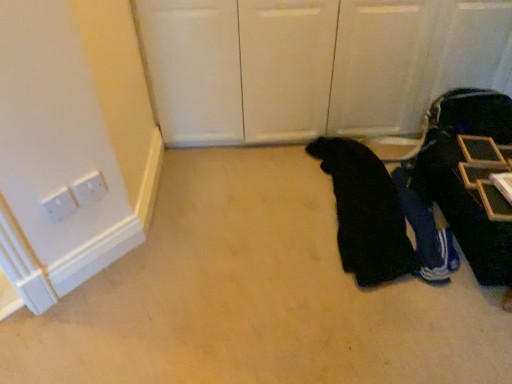
The height and width of the screenshot is (384, 512). I want to click on dark blue fabric suitcase at right, so click(x=462, y=177).

This screenshot has height=384, width=512. Describe the element at coordinates (462, 177) in the screenshot. I see `dark blue fabric suitcase at right` at that location.

The image size is (512, 384). Identify the location of blue fabric pants at lower right, acting as the first person starting from the right. (426, 233).

Is dark blue fabric suitcase at right at the back of black fabric at lower right, acting as the first person starting from the left?

No, black fabric at lower right, acting as the first person starting from the left,'s orientation is not away from dark blue fabric suitcase at right.

Is black fabric at lower right, acting as the first person starting from the left, bigger than dark blue fabric suitcase at right?

Incorrect, black fabric at lower right, acting as the first person starting from the left, is not larger than dark blue fabric suitcase at right.

From a real-world perspective, does black fabric at lower right, acting as the first person starting from the left, stand above dark blue fabric suitcase at right?

Answer: No, from a real-world perspective, black fabric at lower right, acting as the first person starting from the left, is not on top of dark blue fabric suitcase at right.

Is blue fabric pants at lower right, marked as the 2th person in a left-to-right arrangement, further to camera compared to dark blue fabric suitcase at right?

That is True.

Is blue fabric pants at lower right, marked as the 2th person in a left-to-right arrangement, facing away from dark blue fabric suitcase at right?

blue fabric pants at lower right, marked as the 2th person in a left-to-right arrangement, is not turned away from dark blue fabric suitcase at right.

Looking at this image, could blue fabric pants at lower right, acting as the first person starting from the right, be considered to be inside black fabric at lower right, positioned as the second person in right-to-left order?

No, blue fabric pants at lower right, acting as the first person starting from the right, is not surrounded by black fabric at lower right, positioned as the second person in right-to-left order.

Is black fabric at lower right, acting as the first person starting from the left, positioned with its back to blue fabric pants at lower right, acting as the first person starting from the right?

black fabric at lower right, acting as the first person starting from the left, is not turned away from blue fabric pants at lower right, acting as the first person starting from the right.

Considering the positions of points (377, 184) and (445, 271), is point (377, 184) closer to camera compared to point (445, 271)?

That is False.

The height and width of the screenshot is (384, 512). Identify the location of person below the black fabric at lower right, positioned as the second person in right-to-left order (from the image's perspective). (426, 233).

Who is shorter, dark blue fabric suitcase at right or blue fabric pants at lower right, acting as the first person starting from the right?

With less height is blue fabric pants at lower right, acting as the first person starting from the right.

Which object is closer to the camera, dark blue fabric suitcase at right or blue fabric pants at lower right, acting as the first person starting from the right?

dark blue fabric suitcase at right is in front.

From a real-world perspective, who is located higher, dark blue fabric suitcase at right or blue fabric pants at lower right, acting as the first person starting from the right?

dark blue fabric suitcase at right, from a real-world perspective.

Between dark blue fabric suitcase at right and black fabric at lower right, acting as the first person starting from the left, which one has larger width?

black fabric at lower right, acting as the first person starting from the left.

Would you say dark blue fabric suitcase at right is to the left or to the right of black fabric at lower right, positioned as the second person in right-to-left order, in the picture?

Clearly, dark blue fabric suitcase at right is on the right of black fabric at lower right, positioned as the second person in right-to-left order, in the image.

In the scene shown: Is dark blue fabric suitcase at right touching black fabric at lower right, positioned as the second person in right-to-left order?

dark blue fabric suitcase at right is not next to black fabric at lower right, positioned as the second person in right-to-left order, and they're not touching.

Is dark blue fabric suitcase at right aimed at black fabric at lower right, acting as the first person starting from the left?

Yes, dark blue fabric suitcase at right faces towards black fabric at lower right, acting as the first person starting from the left.

How different are the orientations of blue fabric pants at lower right, acting as the first person starting from the right, and black fabric at lower right, acting as the first person starting from the left, in degrees?

blue fabric pants at lower right, acting as the first person starting from the right, and black fabric at lower right, acting as the first person starting from the left, are facing 3.65 degrees away from each other.

Which is further, (448, 233) or (404, 185)?

Point (404, 185)

From a real-world perspective, between blue fabric pants at lower right, marked as the 2th person in a left-to-right arrangement, and black fabric at lower right, acting as the first person starting from the left, who is vertically lower?

blue fabric pants at lower right, marked as the 2th person in a left-to-right arrangement.

Looking at this image, choose the correct answer: Is blue fabric pants at lower right, marked as the 2th person in a left-to-right arrangement, inside black fabric at lower right, acting as the first person starting from the left, or outside it?

blue fabric pants at lower right, marked as the 2th person in a left-to-right arrangement, cannot be found inside black fabric at lower right, acting as the first person starting from the left.

Identify the location of the 1st person located beneath the dark blue fabric suitcase at right (from a real-world perspective). The image size is (512, 384). (379, 217).

Find the location of a particular element. This screenshot has width=512, height=384. luggage above the blue fabric pants at lower right, acting as the first person starting from the right (from a real-world perspective) is located at coordinates 462,177.

Which object lies nearer to the anchor point blue fabric pants at lower right, acting as the first person starting from the right, dark blue fabric suitcase at right or black fabric at lower right, positioned as the second person in right-to-left order?

Based on the image, black fabric at lower right, positioned as the second person in right-to-left order, appears to be nearer to blue fabric pants at lower right, acting as the first person starting from the right.

Looking at the image, which one is located closer to black fabric at lower right, positioned as the second person in right-to-left order, dark blue fabric suitcase at right or blue fabric pants at lower right, marked as the 2th person in a left-to-right arrangement?

The object closer to black fabric at lower right, positioned as the second person in right-to-left order, is blue fabric pants at lower right, marked as the 2th person in a left-to-right arrangement.

When comparing their distances from dark blue fabric suitcase at right, does blue fabric pants at lower right, acting as the first person starting from the right, or black fabric at lower right, acting as the first person starting from the left, seem closer?

blue fabric pants at lower right, acting as the first person starting from the right, lies closer to dark blue fabric suitcase at right than the other object.

When comparing their distances from dark blue fabric suitcase at right, does black fabric at lower right, acting as the first person starting from the left, or blue fabric pants at lower right, acting as the first person starting from the right, seem further?

Among the two, black fabric at lower right, acting as the first person starting from the left, is located further to dark blue fabric suitcase at right.

Based on their spatial positions, is black fabric at lower right, acting as the first person starting from the left, or dark blue fabric suitcase at right closer to blue fabric pants at lower right, marked as the 2th person in a left-to-right arrangement?

Among the two, black fabric at lower right, acting as the first person starting from the left, is located nearer to blue fabric pants at lower right, marked as the 2th person in a left-to-right arrangement.

When comparing their distances from black fabric at lower right, positioned as the second person in right-to-left order, does blue fabric pants at lower right, acting as the first person starting from the right, or dark blue fabric suitcase at right seem further?

Among the two, dark blue fabric suitcase at right is located further to black fabric at lower right, positioned as the second person in right-to-left order.

Find the location of a particular element. person between black fabric at lower right, acting as the first person starting from the left, and dark blue fabric suitcase at right is located at coordinates (426, 233).